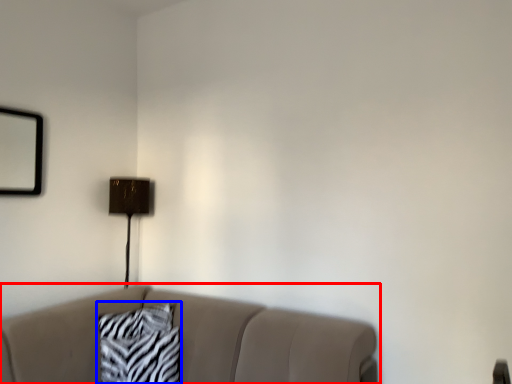
Question: Which object appears closest to the camera in this image, studio couch (highlighted by a red box) or pillow (highlighted by a blue box)?

Choices:
 (A) studio couch
 (B) pillow

Answer: (A)